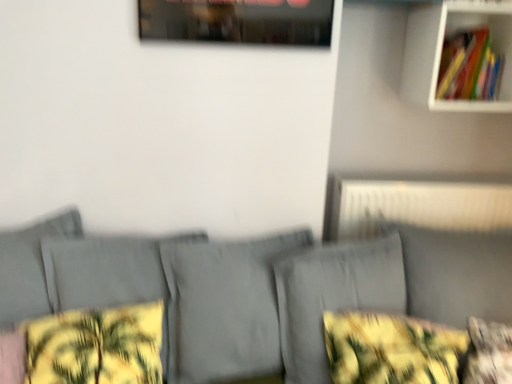
Question: Is gray fabric couch at center positioned with its back to yellow floral fabric at lower right?

Choices:
 (A) yes
 (B) no

Answer: (B)

Question: From the image's perspective, is gray fabric couch at center over yellow floral fabric at lower right?

Choices:
 (A) yes
 (B) no

Answer: (A)

Question: Considering the relative sizes of gray fabric couch at center and yellow floral fabric at lower right in the image provided, is gray fabric couch at center bigger than yellow floral fabric at lower right?

Choices:
 (A) no
 (B) yes

Answer: (B)

Question: Would you say yellow floral fabric at lower right is part of gray fabric couch at center's contents?

Choices:
 (A) yes
 (B) no

Answer: (B)

Question: Is gray fabric couch at center far away from yellow floral fabric at lower right?

Choices:
 (A) yes
 (B) no

Answer: (B)

Question: Does point 222,344 appear closer or farther from the camera than point 143,331?

Choices:
 (A) farther
 (B) closer

Answer: (A)

Question: Considering the positions of gray fabric couch at center and yellow floral fabric pillow at lower left, marked as the second pillow in a right-to-left arrangement, in the image, is gray fabric couch at center bigger or smaller than yellow floral fabric pillow at lower left, marked as the second pillow in a right-to-left arrangement,?

Choices:
 (A) big
 (B) small

Answer: (A)

Question: Considering their positions, is gray fabric couch at center located in front of or behind yellow floral fabric pillow at lower left, marked as the second pillow in a right-to-left arrangement?

Choices:
 (A) front
 (B) behind

Answer: (A)

Question: From the image's perspective, is gray fabric couch at center positioned above or below yellow floral fabric pillow at lower left, positioned as the 1th pillow in left-to-right order?

Choices:
 (A) above
 (B) below

Answer: (B)

Question: Based on their positions, is yellow floral fabric pillow at lower right, arranged as the 2th pillow when viewed from the left, located to the left or right of gray fabric couch at center?

Choices:
 (A) right
 (B) left

Answer: (A)

Question: In terms of height, does yellow floral fabric pillow at lower right, arranged as the 2th pillow when viewed from the left, look taller or shorter compared to gray fabric couch at center?

Choices:
 (A) tall
 (B) short

Answer: (B)

Question: Is yellow floral fabric pillow at lower right, arranged as the 2th pillow when viewed from the left, in front of or behind gray fabric couch at center in the image?

Choices:
 (A) behind
 (B) front

Answer: (A)

Question: Do you think yellow floral fabric pillow at lower right, acting as the first pillow starting from the right, is within gray fabric couch at center, or outside of it?

Choices:
 (A) outside
 (B) inside

Answer: (A)

Question: In terms of size, does white matte shelf at upper right appear bigger or smaller than white textured radiator at upper right?

Choices:
 (A) big
 (B) small

Answer: (A)

Question: Is white matte shelf at upper right inside the boundaries of white textured radiator at upper right, or outside?

Choices:
 (A) inside
 (B) outside

Answer: (B)